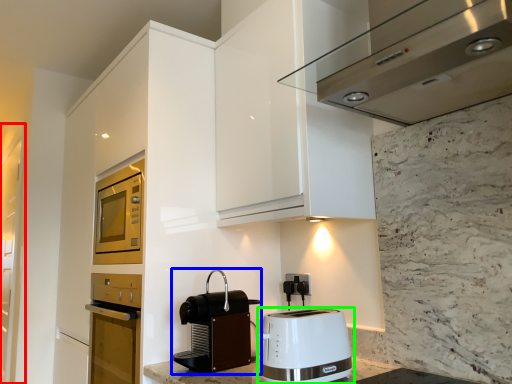
Question: Based on their relative distances, which object is nearer to glass door (highlighted by a red box)? Choose from kitchen appliance (highlighted by a blue box) and toaster (highlighted by a green box).

Choices:
 (A) kitchen appliance
 (B) toaster

Answer: (A)